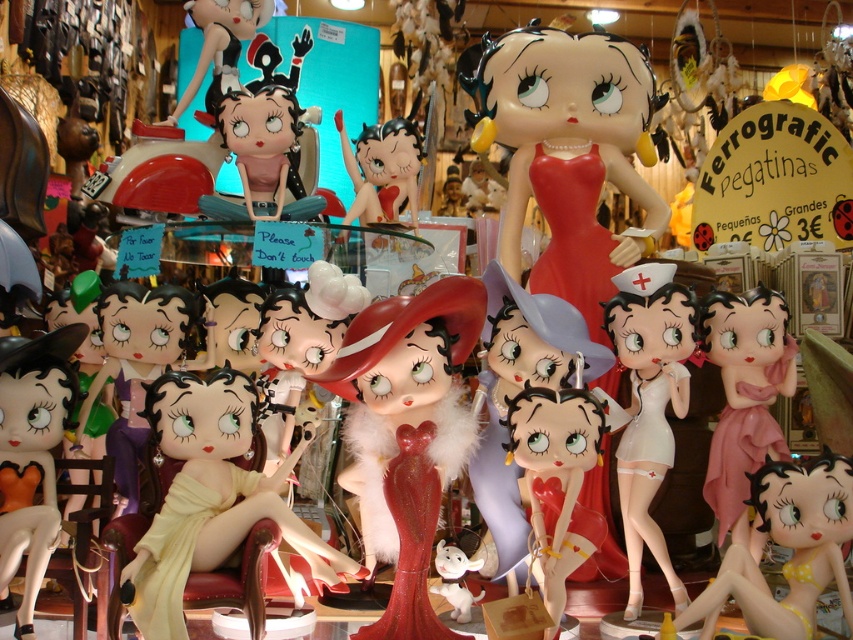
Question: Among these points, which one is nearest to the camera?

Choices:
 (A) (744, 492)
 (B) (376, 387)

Answer: (B)

Question: Can you confirm if shiny red dress at center is positioned below white plush elephant at center?

Choices:
 (A) no
 (B) yes

Answer: (A)

Question: Which point is farther to the camera?

Choices:
 (A) (834, 557)
 (B) (724, 512)
 (C) (294, 188)

Answer: (C)

Question: Among these points, which one is farthest from the camera?

Choices:
 (A) (778, 301)
 (B) (421, 360)

Answer: (A)

Question: Can you confirm if pink glossy figurine at center is thinner than white plush elephant at center?

Choices:
 (A) no
 (B) yes

Answer: (A)

Question: Does yellow polka dot bikini at center have a smaller size compared to pink glossy figurine at center?

Choices:
 (A) yes
 (B) no

Answer: (B)